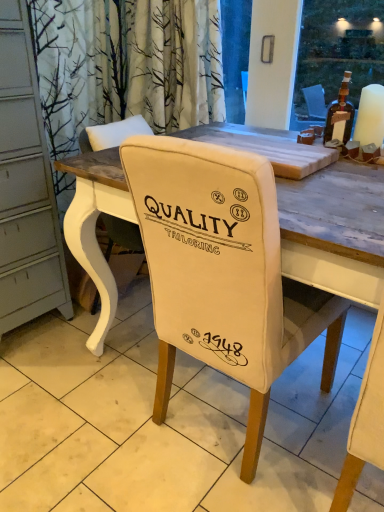
Locate an element on the screen. The height and width of the screenshot is (512, 384). vacant space situated above white fabric chair back at center (from a real-world perspective) is located at coordinates (118, 416).